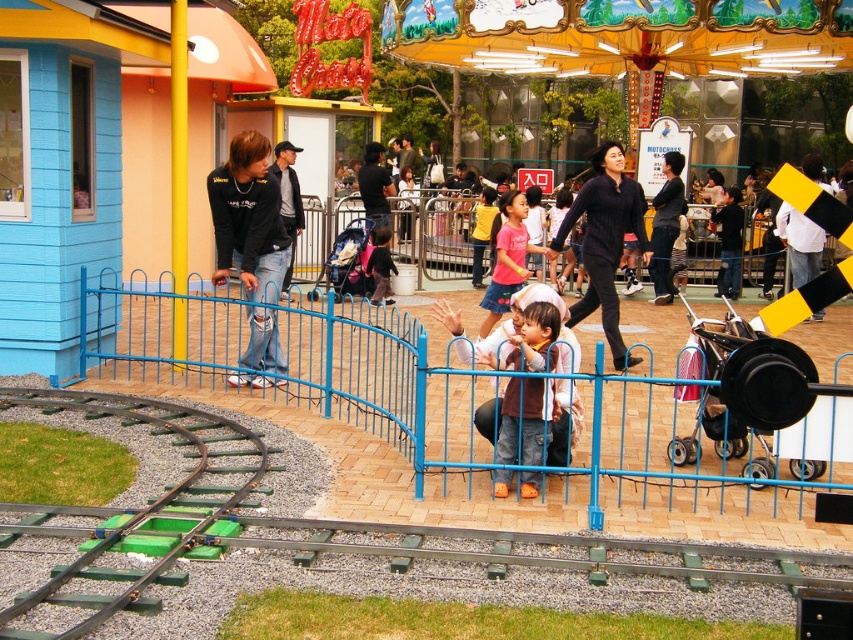
Between point (508, 387) and point (666, 228), which one is positioned behind?

The point (666, 228) is more distant.

Does orange suede shoes at center have a lesser width compared to matte black shirt at center?

Yes, orange suede shoes at center is thinner than matte black shirt at center.

Which is in front, point (540, 353) or point (654, 292)?

Point (540, 353)

The width and height of the screenshot is (853, 640). What are the coordinates of `orange suede shoes at center` in the screenshot? It's located at (524, 420).

Find the location of a particular element. matte black shirt at center is located at coordinates (665, 225).

Between matte black shirt at center and matte pink shirt at center, which one is positioned lower?

Positioned lower is matte pink shirt at center.

Is point (653, 204) closer to camera compared to point (387, 292)?

That is False.

Find the location of a particular element. This screenshot has width=853, height=640. matte black shirt at center is located at coordinates (665, 225).

Is orange suede shoes at center bigger than matte pink shirt at center?

Actually, orange suede shoes at center might be smaller than matte pink shirt at center.

From the picture: Can you confirm if orange suede shoes at center is thinner than matte pink shirt at center?

No, orange suede shoes at center is not thinner than matte pink shirt at center.

What are the coordinates of `orange suede shoes at center` in the screenshot? It's located at click(x=524, y=420).

You are a GUI agent. You are given a task and a screenshot of the screen. Output one action in this format:
    pyautogui.click(x=<x>, y=<y>)
    Task: Click on the orange suede shoes at center
    This screenshot has height=640, width=853.
    Given the screenshot: What is the action you would take?
    pyautogui.click(x=524, y=420)